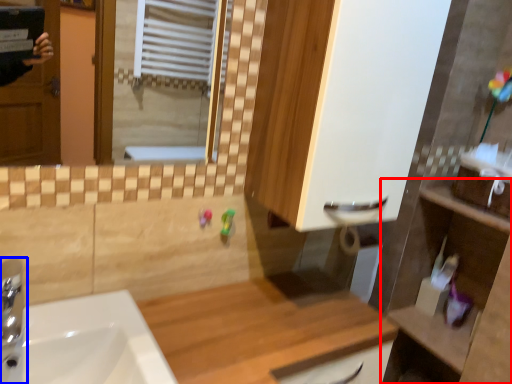
Question: Among these objects, which one is farthest to the camera, counter (highlighted by a red box) or tap (highlighted by a blue box)?

Choices:
 (A) counter
 (B) tap

Answer: (A)